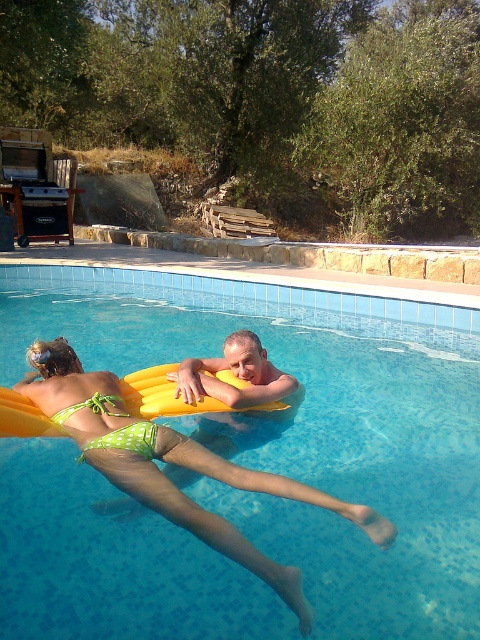
Does transparent plastic pool at center have a larger size compared to smooth yellow float at center?

Incorrect, transparent plastic pool at center is not larger than smooth yellow float at center.

Can you confirm if transparent plastic pool at center is shorter than smooth yellow float at center?

Indeed, transparent plastic pool at center has a lesser height compared to smooth yellow float at center.

This screenshot has height=640, width=480. I want to click on transparent plastic pool at center, so click(311, 426).

Find the location of `transparent plastic pool at center`. transparent plastic pool at center is located at coordinates click(311, 426).